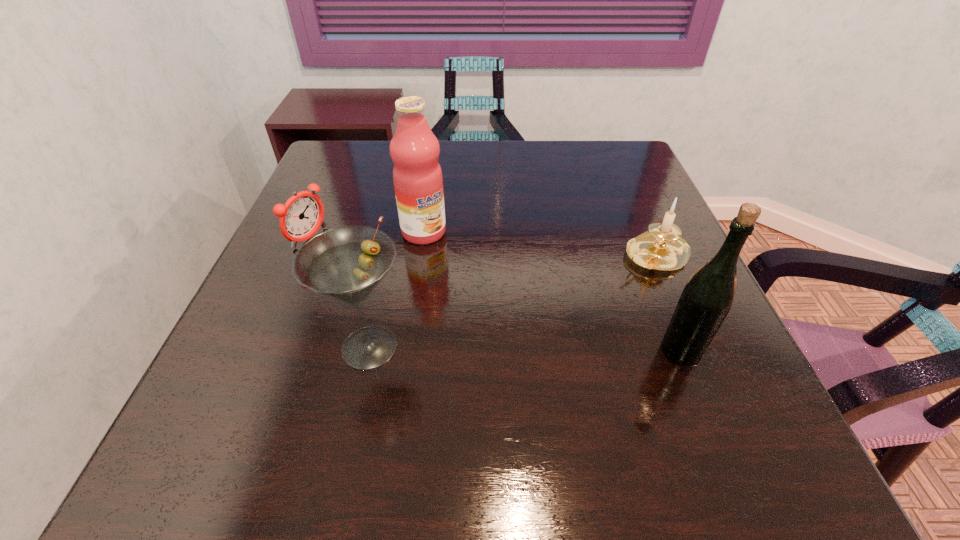
Locate an element on the screen. Image resolution: width=960 pixels, height=540 pixels. the third shortest object is located at coordinates point(346,263).

Find the location of a particular element. beer bottle is located at coordinates (707, 297).

Where is `fruit juice`? fruit juice is located at coordinates (417, 176).

Image resolution: width=960 pixels, height=540 pixels. Find the location of `alarm clock`. alarm clock is located at coordinates (302, 215).

The width and height of the screenshot is (960, 540). Find the location of `the shortest object`. the shortest object is located at coordinates (302, 215).

Where is `candle holder`? Image resolution: width=960 pixels, height=540 pixels. candle holder is located at coordinates (661, 248).

The height and width of the screenshot is (540, 960). I want to click on free region located 0.220m on the back of the martini, so click(x=393, y=243).

The height and width of the screenshot is (540, 960). What are the coordinates of `free space located on the back of the beer bottle` in the screenshot? It's located at pyautogui.click(x=631, y=226).

What are the coordinates of `free space located 0.240m on the label of the fruit juice` in the screenshot? It's located at (495, 308).

Find the location of `free space located 0.330m on the label of the fruit juice`. free space located 0.330m on the label of the fruit juice is located at coordinates (x=524, y=339).